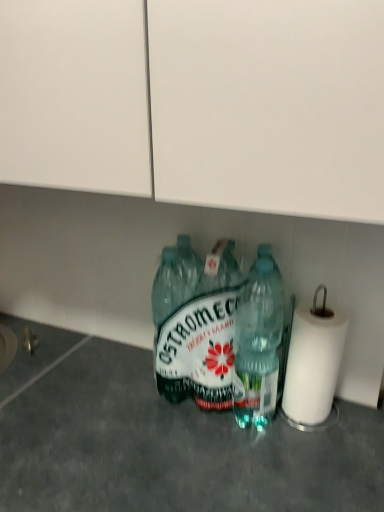
Question: From the image's perspective, is transparent plastic bottles at center under white paper at right?

Choices:
 (A) no
 (B) yes

Answer: (B)

Question: Is transparent plastic bottles at center shorter than white paper at right?

Choices:
 (A) yes
 (B) no

Answer: (B)

Question: Is transparent plastic bottles at center behind white paper at right?

Choices:
 (A) no
 (B) yes

Answer: (A)

Question: Is transparent plastic bottles at center bigger than white paper at right?

Choices:
 (A) no
 (B) yes

Answer: (B)

Question: Is the position of transparent plastic bottles at center less distant than that of white paper at right?

Choices:
 (A) no
 (B) yes

Answer: (B)

Question: In the image, is green plastic bottle at center, which appears as the first bottle when viewed from the left, positioned in front of or behind translucent plastic bottle at center, acting as the 2th bottle starting from the left?

Choices:
 (A) behind
 (B) front

Answer: (A)

Question: In terms of height, does green plastic bottle at center, which appears as the first bottle when viewed from the left, look taller or shorter compared to translucent plastic bottle at center, the first bottle from the right?

Choices:
 (A) tall
 (B) short

Answer: (B)

Question: From the image's perspective, relative to translucent plastic bottle at center, acting as the 2th bottle starting from the left, is green plastic bottle at center, which ranks as the second bottle in right-to-left order, above or below?

Choices:
 (A) below
 (B) above

Answer: (B)

Question: In the image, is green plastic bottle at center, which ranks as the second bottle in right-to-left order, on the left side or the right side of translucent plastic bottle at center, the first bottle from the right?

Choices:
 (A) left
 (B) right

Answer: (A)

Question: Considering the positions of point (332, 368) and point (294, 501), is point (332, 368) closer or farther from the camera than point (294, 501)?

Choices:
 (A) farther
 (B) closer

Answer: (A)

Question: Looking at the image, does white paper at right seem bigger or smaller compared to transparent plastic bottles at center?

Choices:
 (A) small
 (B) big

Answer: (A)

Question: From the image's perspective, is white paper at right located above or below transparent plastic bottles at center?

Choices:
 (A) above
 (B) below

Answer: (A)

Question: Looking at their shapes, would you say white paper at right is wider or thinner than transparent plastic bottles at center?

Choices:
 (A) wide
 (B) thin

Answer: (B)

Question: Is translucent plastic bottle at center, acting as the 2th bottle starting from the left, taller or shorter than white paper at right?

Choices:
 (A) short
 (B) tall

Answer: (B)

Question: In the image, is translucent plastic bottle at center, the first bottle from the right, on the left side or the right side of white paper at right?

Choices:
 (A) right
 (B) left

Answer: (B)